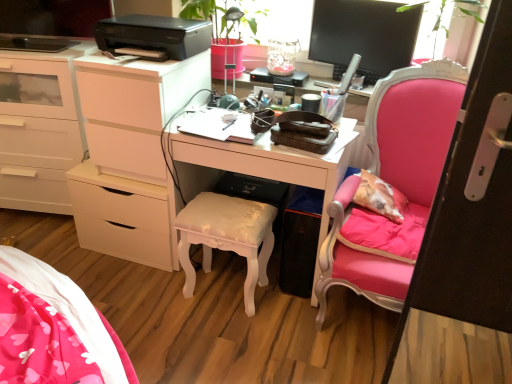
Question: Is green matte plant at upper center to the right of white glossy chest of drawers at left from the viewer's perspective?

Choices:
 (A) no
 (B) yes

Answer: (B)

Question: Can you confirm if green matte plant at upper center is positioned to the left of white glossy chest of drawers at left?

Choices:
 (A) no
 (B) yes

Answer: (A)

Question: Is green matte plant at upper center completely or partially outside of white glossy chest of drawers at left?

Choices:
 (A) yes
 (B) no

Answer: (A)

Question: From the image's perspective, does green matte plant at upper center appear lower than white glossy chest of drawers at left?

Choices:
 (A) yes
 (B) no

Answer: (B)

Question: Is white glossy chest of drawers at left completely or partially inside green matte plant at upper center?

Choices:
 (A) yes
 (B) no

Answer: (B)

Question: Does green matte plant at upper center have a greater width compared to white glossy chest of drawers at left?

Choices:
 (A) yes
 (B) no

Answer: (B)

Question: Is there a large distance between white glossy desk at center and pink velvet chair at right?

Choices:
 (A) no
 (B) yes

Answer: (A)

Question: Considering the relative sizes of white glossy desk at center and pink velvet chair at right in the image provided, is white glossy desk at center thinner than pink velvet chair at right?

Choices:
 (A) no
 (B) yes

Answer: (B)

Question: Is white glossy desk at center not within pink velvet chair at right?

Choices:
 (A) yes
 (B) no

Answer: (A)

Question: Is the depth of white glossy desk at center greater than that of pink velvet chair at right?

Choices:
 (A) yes
 (B) no

Answer: (A)

Question: Considering the relative positions of white glossy desk at center and pink velvet chair at right in the image provided, is white glossy desk at center in front of pink velvet chair at right?

Choices:
 (A) no
 (B) yes

Answer: (A)

Question: From a real-world perspective, is white glossy desk at center beneath pink velvet chair at right?

Choices:
 (A) no
 (B) yes

Answer: (B)

Question: Considering the relative sizes of white glossy stool at center and black glossy monitor at upper right in the image provided, is white glossy stool at center thinner than black glossy monitor at upper right?

Choices:
 (A) no
 (B) yes

Answer: (A)